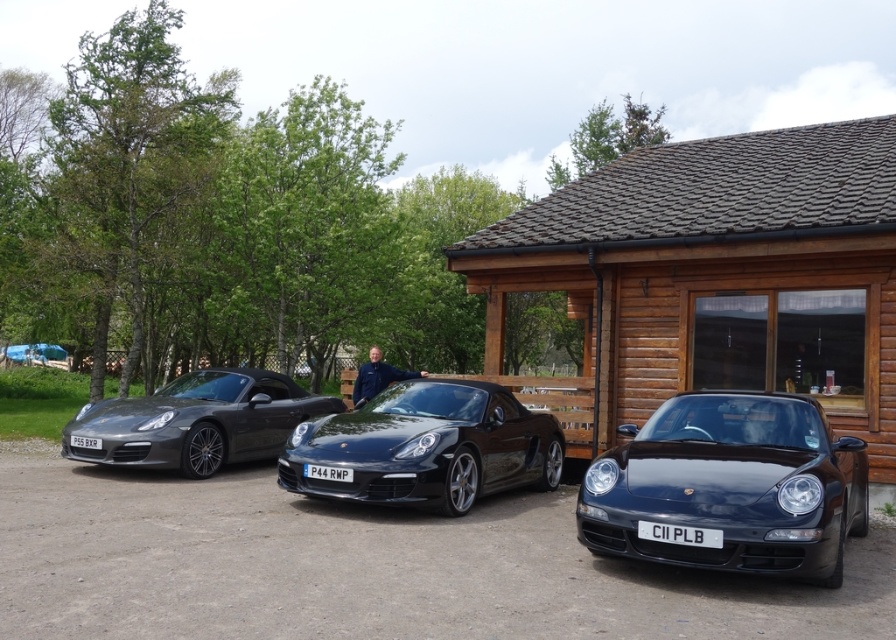
You are a delivery person needing to place a 4.2 meter long box between the glossy black porsche at center and the gray metallic license plate at left. Can the box fit in the space between them?

The glossy black porsche at center and gray metallic license plate at left are 4.29 meters apart, so yes, the 4.2 meter long box can fit in the space between them since it is slightly shorter than the available distance.

You are a photographer planning to take a photo of the glossy black porsche at center. To ensure it is centered in the frame, where should you position your camera relative to the scene?

The glossy black porsche at center is located at point (427, 445), so you should position your camera directly facing that coordinate to center it in the frame.

What is the 2D coordinate of the glossy black porsche at center?

The glossy black porsche at center is located at the 2D coordinate point of [427,445].